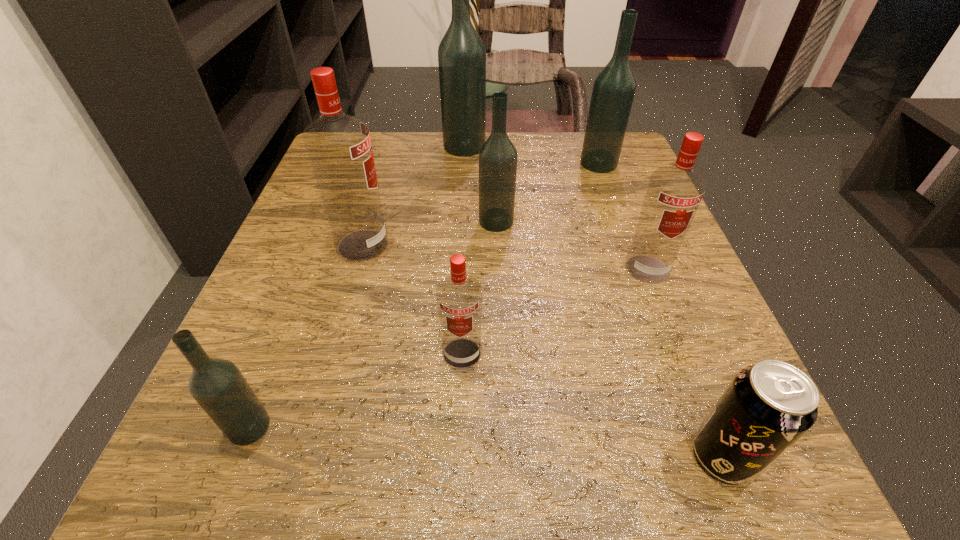
The height and width of the screenshot is (540, 960). What are the coordinates of `unoccupied position between the second smallest red vodka and the third nearest object` in the screenshot? It's located at (555, 311).

This screenshot has width=960, height=540. I want to click on free space between the second biggest red vodka and the sixth farthest object, so click(555, 311).

Locate an element on the screen. object that is the fourth closest to the smallest red vodka is located at coordinates (768, 406).

Identify which object is the seventh nearest to the nearest vodka. Please provide its 2D coordinates. Your answer should be formatted as a tuple, i.e. [(x, y)], where the tuple contains the x and y coordinates of a point satisfying the conditions above.

[(614, 87)]

I want to click on the second closest vodka to the biggest red vodka, so click(459, 296).

Select which vodka appears as the fourth closest to the leftmost object. Please provide its 2D coordinates. Your answer should be formatted as a tuple, i.e. [(x, y)], where the tuple contains the x and y coordinates of a point satisfying the conditions above.

[(674, 193)]

The width and height of the screenshot is (960, 540). What are the coordinates of `black vodka that stands as the closest to the shortest object` in the screenshot? It's located at (x=498, y=156).

Point out which black vodka is positioned as the nearest to the second smallest black vodka. Please provide its 2D coordinates. Your answer should be formatted as a tuple, i.e. [(x, y)], where the tuple contains the x and y coordinates of a point satisfying the conditions above.

[(461, 53)]

The image size is (960, 540). I want to click on red vodka that is the third nearest to the shortest object, so pyautogui.click(x=339, y=148).

Select which red vodka appears as the closest to the tallest vodka. Please provide its 2D coordinates. Your answer should be formatted as a tuple, i.e. [(x, y)], where the tuple contains the x and y coordinates of a point satisfying the conditions above.

[(339, 148)]